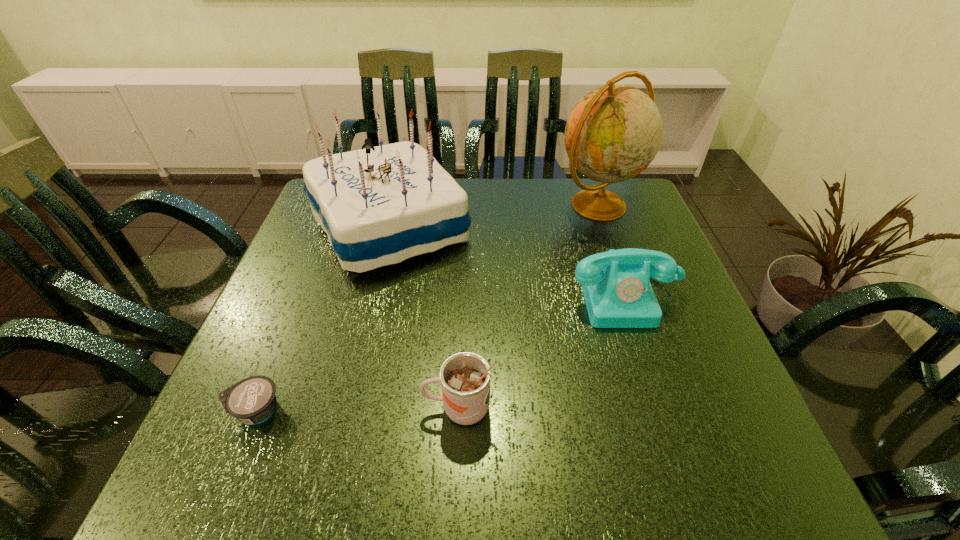
Find the location of a particular element. Image resolution: width=960 pixels, height=540 pixels. free spot at the far edge of the desktop is located at coordinates [x=566, y=224].

This screenshot has width=960, height=540. In the image, there is a desktop. Find the location of `vacant space at the near edge`. vacant space at the near edge is located at coordinates (391, 468).

The image size is (960, 540). I want to click on vacant space at the left edge of the desktop, so click(300, 282).

The height and width of the screenshot is (540, 960). In order to click on vacant area at the right edge in this screenshot , I will do `click(686, 286)`.

Where is `free region at the far left corner of the desktop`? Image resolution: width=960 pixels, height=540 pixels. free region at the far left corner of the desktop is located at coordinates (318, 225).

Where is `vacant space at the near left corner`? This screenshot has height=540, width=960. vacant space at the near left corner is located at coordinates (259, 461).

At what (x,y) coordinates should I click in order to perform the action: click on blank space at the far right corner. Please return your answer as a coordinate pair (x, y). The image size is (960, 540). Looking at the image, I should click on (586, 179).

You are a GUI agent. You are given a task and a screenshot of the screen. Output one action in this format:
    pyautogui.click(x=<x>, y=<y>)
    Task: Click on the free point between the cup and the telephone
    The image size is (960, 540).
    Given the screenshot: What is the action you would take?
    pos(542,353)

Where is `free space between the cup and the telephone`? free space between the cup and the telephone is located at coordinates (542, 353).

This screenshot has width=960, height=540. Find the location of `free space between the cup and the shortest object`. free space between the cup and the shortest object is located at coordinates (357, 409).